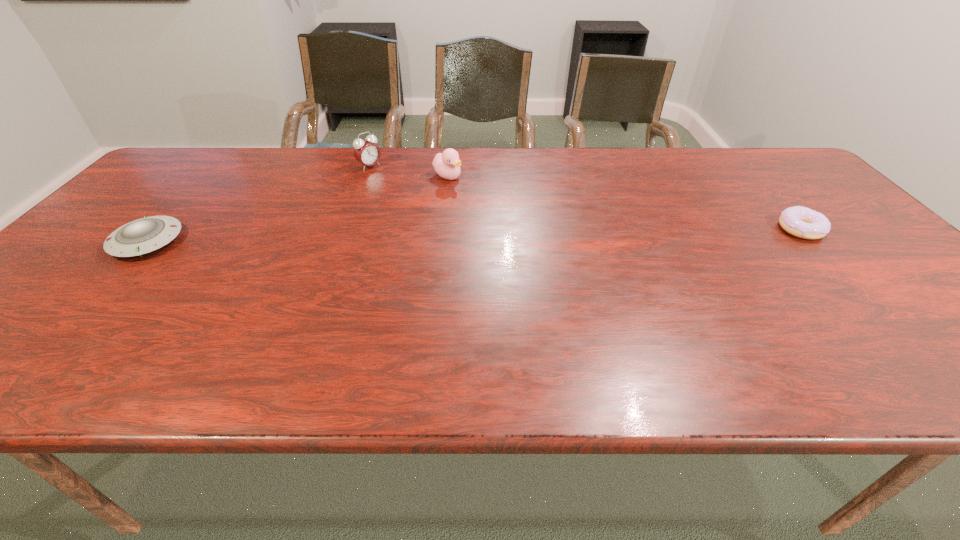
At what (x,y) coordinates should I click in order to perform the action: click on free space at the far left corner of the desktop. Please return your answer as a coordinate pair (x, y). Looking at the image, I should click on (213, 156).

The width and height of the screenshot is (960, 540). Find the location of `vacant space at the near left corner of the desktop`. vacant space at the near left corner of the desktop is located at coordinates (65, 333).

Where is `free region at the far right corner`? The image size is (960, 540). free region at the far right corner is located at coordinates (772, 160).

Image resolution: width=960 pixels, height=540 pixels. I want to click on vacant point located between the third shortest object and the third object from right to left, so click(409, 172).

The image size is (960, 540). Identify the location of vacant region between the alarm clock and the doughnut. (586, 198).

In order to click on unoccupied area between the doughnut and the alarm clock in this screenshot , I will do `click(586, 198)`.

At what (x,y) coordinates should I click in order to perform the action: click on empty location between the leftmost object and the alarm clock. Please return your answer as a coordinate pair (x, y). This screenshot has width=960, height=540. Looking at the image, I should click on (258, 204).

What are the coordinates of `free space between the third object from right to left and the rightmost object` in the screenshot? It's located at (586, 198).

Where is `vacant region between the doughnut and the saucer`? vacant region between the doughnut and the saucer is located at coordinates (474, 235).

Where is `free space between the leftmost object and the duckling`? free space between the leftmost object and the duckling is located at coordinates (298, 209).